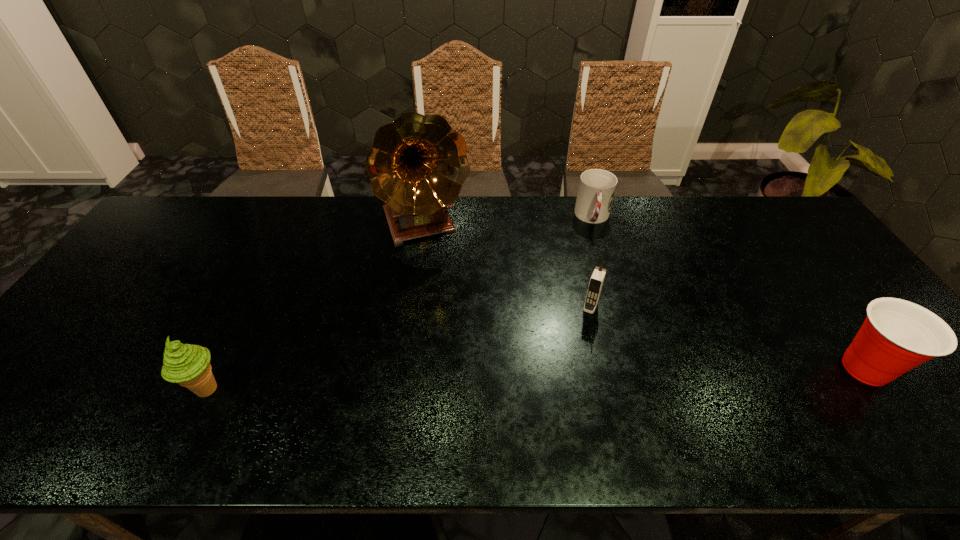
At what (x,y) coordinates should I click in order to perform the action: click on vacant space located 0.380m on the side of the shortest object where the handle is located. Please return your answer as a coordinate pair (x, y). Looking at the image, I should click on (603, 325).

You are a GUI agent. You are given a task and a screenshot of the screen. Output one action in this format:
    pyautogui.click(x=<x>, y=<y>)
    Task: Click on the free point located 0.160m on the side of the shortest object where the handle is located
    This screenshot has height=540, width=960.
    Given the screenshot: What is the action you would take?
    pyautogui.click(x=598, y=267)

The image size is (960, 540). In order to click on free spot located on the side of the shortest object where the handle is located in this screenshot , I will do `click(603, 325)`.

At what (x,y) coordinates should I click in order to perform the action: click on vacant space located on the front-facing side of the cellular telephone. Please return your answer as a coordinate pair (x, y). Looking at the image, I should click on (556, 392).

Locate an element on the screen. The image size is (960, 540). blank space located 0.150m on the front-facing side of the cellular telephone is located at coordinates pyautogui.click(x=571, y=356).

Identify the location of free location located on the front-facing side of the cellular telephone. Image resolution: width=960 pixels, height=540 pixels. (583, 327).

The height and width of the screenshot is (540, 960). I want to click on free space located on the horn of the phonograph_record, so click(x=465, y=326).

Where is `vacant space located on the horn of the phonograph_record`? vacant space located on the horn of the phonograph_record is located at coordinates (447, 281).

You are a GUI agent. You are given a task and a screenshot of the screen. Output one action in this format:
    pyautogui.click(x=<x>, y=<y>)
    Task: Click on the vacant space positioned 0.050m on the horn of the phonograph_record
    
    Given the screenshot: What is the action you would take?
    pyautogui.click(x=441, y=265)

Find the location of a particular element. cup that is at the far edge is located at coordinates (597, 187).